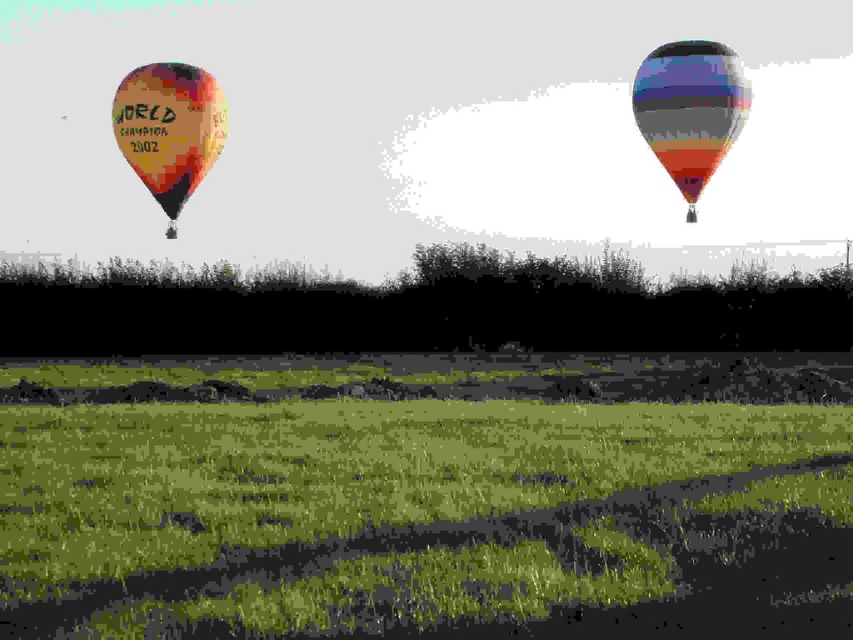
Question: Which is nearer to the multicolored fabric balloon at left?

Choices:
 (A) multicolored striped balloon at upper right
 (B) green grassy field at lower center

Answer: (B)

Question: Can you confirm if green grassy field at lower center is smaller than multicolored fabric balloon at left?

Choices:
 (A) no
 (B) yes

Answer: (A)

Question: Does green grassy field at lower center have a larger size compared to multicolored striped balloon at upper right?

Choices:
 (A) no
 (B) yes

Answer: (B)

Question: Among these points, which one is nearest to the camera?

Choices:
 (A) (680, 129)
 (B) (850, 420)

Answer: (B)

Question: Can you confirm if multicolored striped balloon at upper right is positioned below multicolored fabric balloon at left?

Choices:
 (A) yes
 (B) no

Answer: (B)

Question: Which object appears closest to the camera in this image?

Choices:
 (A) multicolored fabric balloon at left
 (B) green grassy field at lower center
 (C) multicolored striped balloon at upper right

Answer: (B)